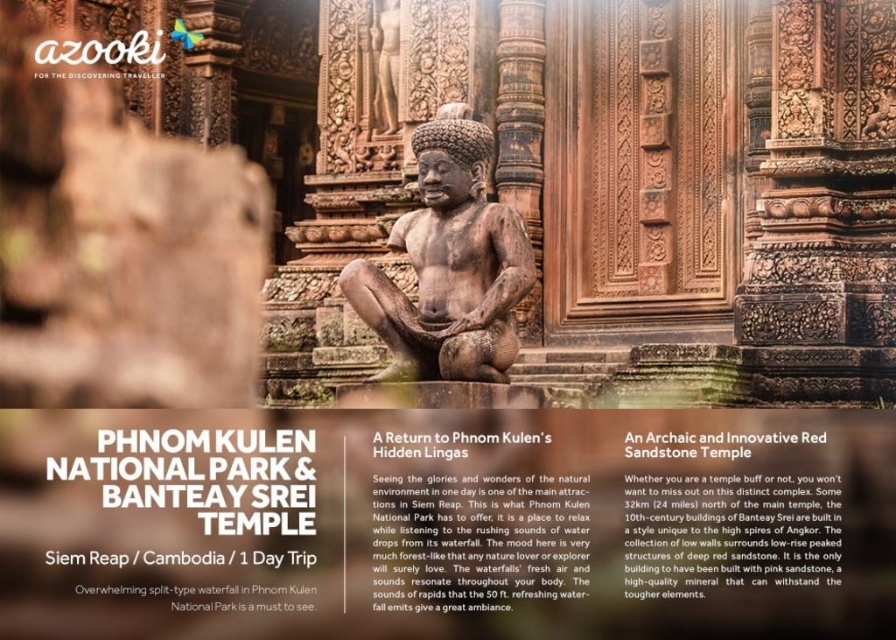
You are standing at the entrance of the temple and want to take a photo of the point at coordinates (363, 440). The camera you are using has a focal length of 50mm and a sensor size of 24mm x 36mm. What is the minimum distance you need to move forward to ensure the point fills the frame vertically?

The point at coordinates (363, 440) is 45.03 meters away from the camera. To calculate the minimum distance needed to fill the frame vertically, use the formula distance_new_distance_old multiplied by sensor_height_over_2 divided by the desired height. However, since the point is a single coordinate, it cannot fill the frame vertically. Therefore, you cannot achieve this with a single point.

You are an archaeologist examining two statues in the temple courtyard. You have the matte sandstone statue at center and the brown stone statue at center. Which statue takes up more physical space in the courtyard?

The brown stone statue at center occupies more space than the matte sandstone statue at center.